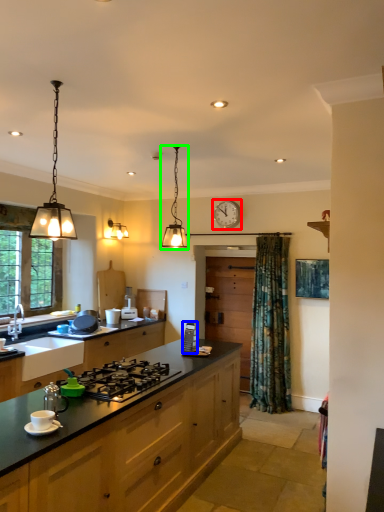
Question: Which object is the closest to the clock (highlighted by a red box)? Choose among these: appliance (highlighted by a blue box) or light fixture (highlighted by a green box).

Choices:
 (A) appliance
 (B) light fixture

Answer: (A)